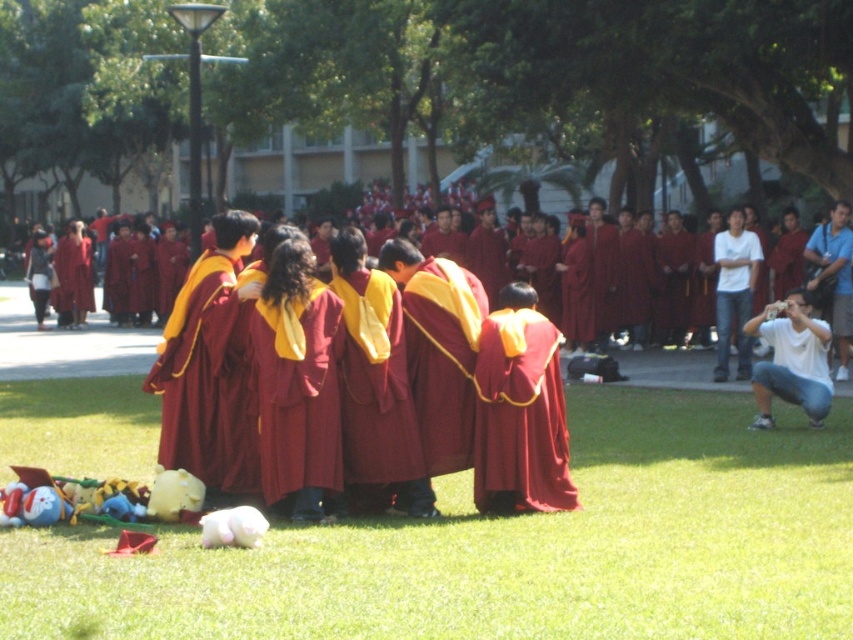
Where is `matte red graduation gown at center`? The width and height of the screenshot is (853, 640). matte red graduation gown at center is located at coordinates tap(67, 342).

Is matte red graduation gown at center shorter than white cotton shirt at lower right?

In fact, matte red graduation gown at center may be taller than white cotton shirt at lower right.

Find the location of a particular element. This screenshot has width=853, height=640. matte red graduation gown at center is located at coordinates (67, 342).

Does maroon velvet graduation gown at center have a greater width compared to white cotton shirt at right?

In fact, maroon velvet graduation gown at center might be narrower than white cotton shirt at right.

Who is positioned more to the left, maroon velvet graduation gown at center or white cotton shirt at right?

maroon velvet graduation gown at center is more to the left.

What are the coordinates of `maroon velvet graduation gown at center` in the screenshot? It's located at (195, 365).

Can you confirm if white cotton shirt at lower right is positioned to the left of white cotton shirt at right?

Correct, you'll find white cotton shirt at lower right to the left of white cotton shirt at right.

Who is more forward, (755, 380) or (740, 364)?

Point (755, 380) is more forward.

This screenshot has height=640, width=853. Identify the location of white cotton shirt at lower right. (791, 358).